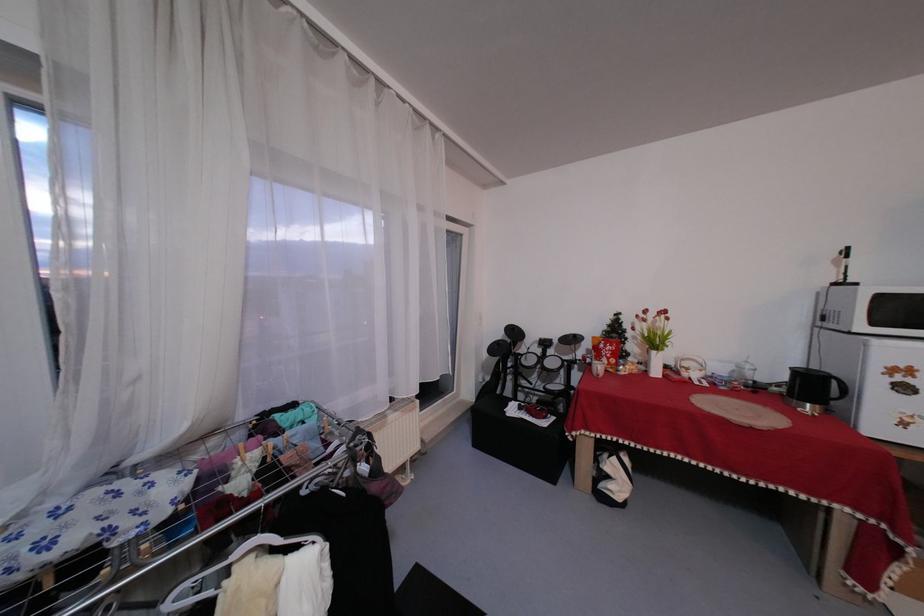
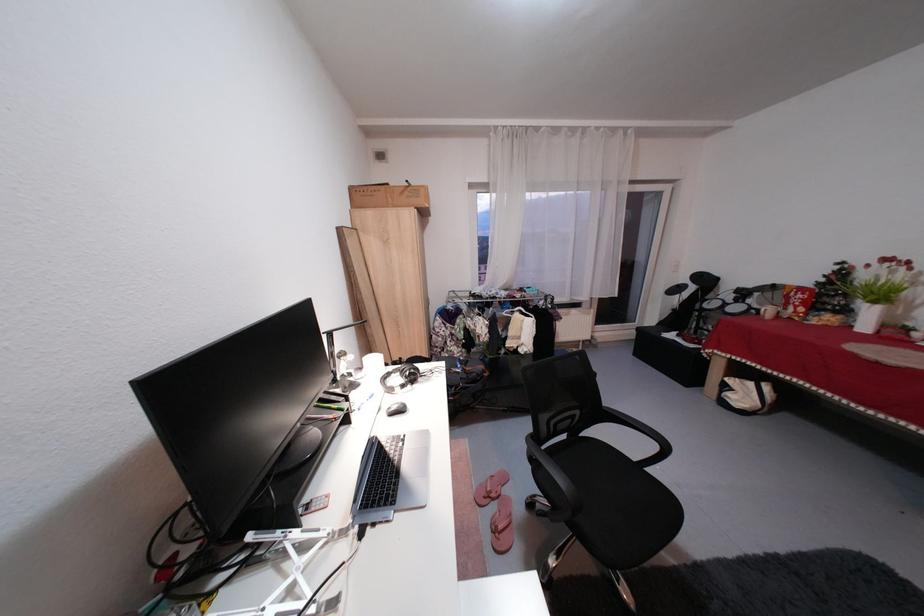
The point at (x=626, y=458) is marked in the first image. Where is the corresponding point in the second image?

(764, 384)